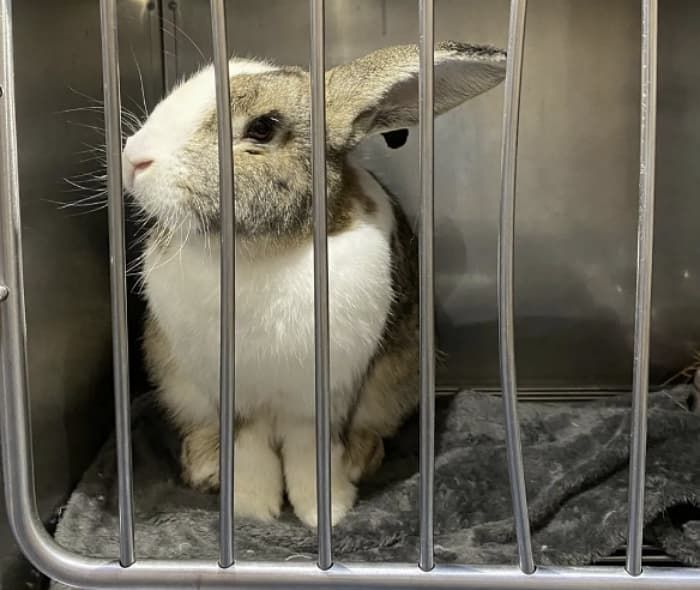
The height and width of the screenshot is (590, 700). I want to click on chest, so click(x=265, y=334).